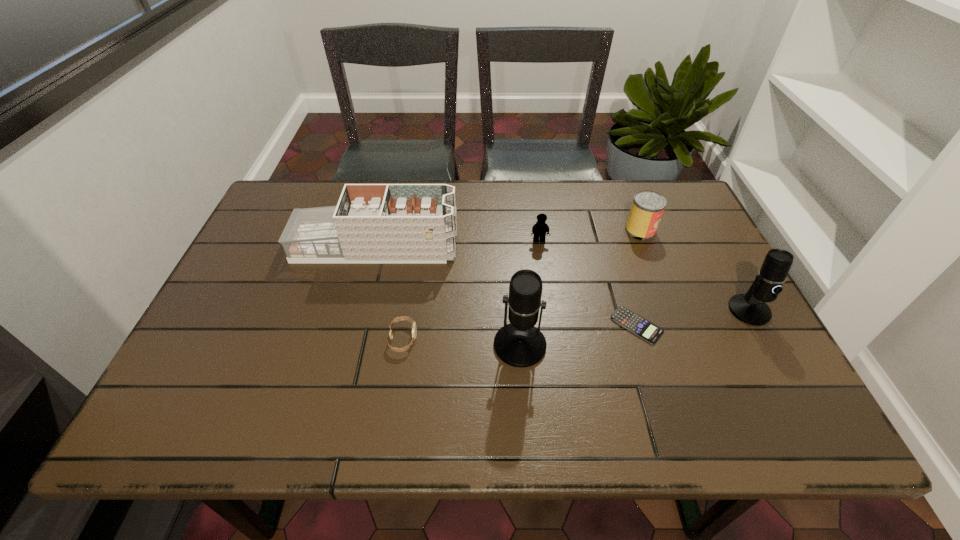
Where is `vacant region located 0.190m on the left of the shorter microphone`? The width and height of the screenshot is (960, 540). vacant region located 0.190m on the left of the shorter microphone is located at coordinates (651, 310).

Find the location of a particular element. free point located at the entrance of the dollhouse is located at coordinates (601, 247).

You are a GUI agent. You are given a task and a screenshot of the screen. Output one action in this format:
    pyautogui.click(x=<x>, y=<y>)
    Task: Click on the free space located on the front-facing side of the Lego
    This screenshot has width=960, height=540.
    Given the screenshot: What is the action you would take?
    pyautogui.click(x=546, y=291)

Image resolution: width=960 pixels, height=540 pixels. Find the location of `blank space located 0.210m on the back of the calculator`. blank space located 0.210m on the back of the calculator is located at coordinates (613, 249).

Where is `free point located 0.290m on the left of the fourth tallest object`? Image resolution: width=960 pixels, height=540 pixels. free point located 0.290m on the left of the fourth tallest object is located at coordinates (525, 231).

In order to click on vacant space situated on the face of the sixth tallest object in this screenshot , I will do `click(468, 339)`.

Identify the location of object that is at the far edge. This screenshot has height=540, width=960. (647, 208).

In order to click on object positioned at the near edge in this screenshot , I will do `click(520, 344)`.

The height and width of the screenshot is (540, 960). Find the location of `object positioned at the left edge`. object positioned at the left edge is located at coordinates (378, 223).

Where is `microphone that is at the right edge`? The height and width of the screenshot is (540, 960). microphone that is at the right edge is located at coordinates click(x=750, y=308).